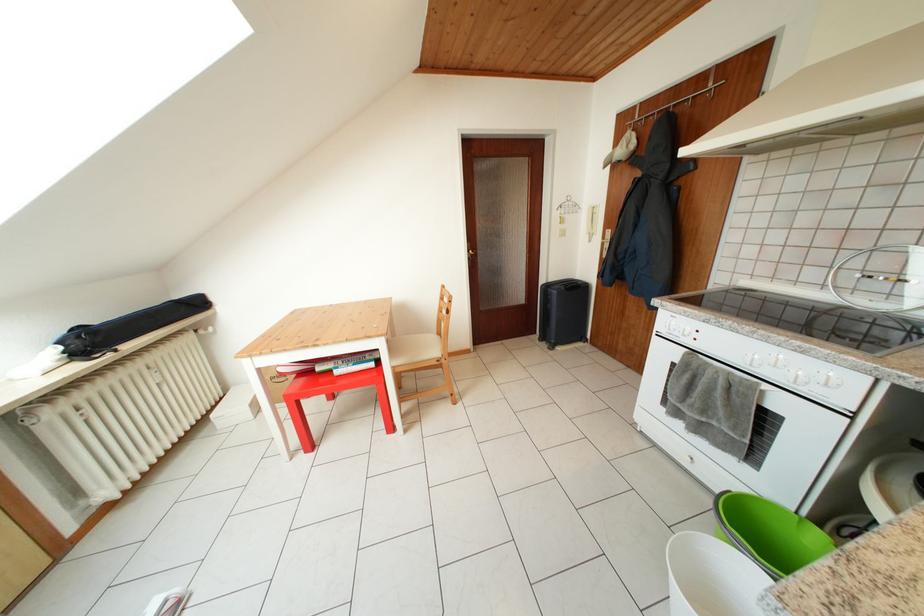
Where would you sit the chair sitting surface? Please return your answer as a coordinate pair (x, y).

(414, 349)